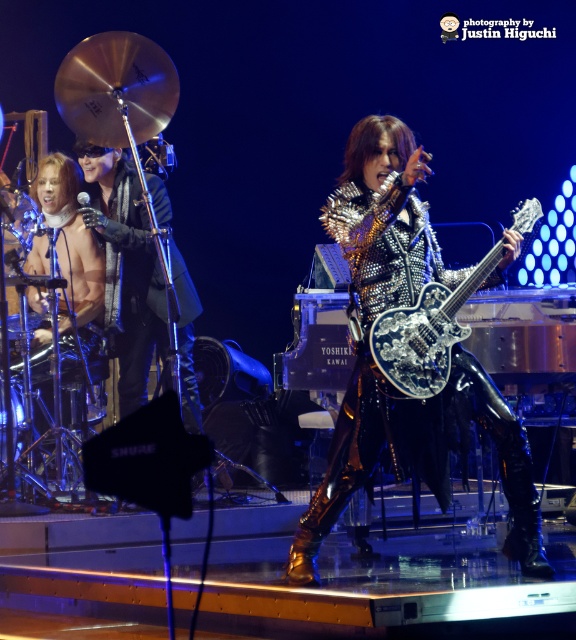
You are a photographer at the concert. You need to place a spotlight at the point with coordinates point (376, 365). Which object should you direct the spotlight towards?

The point (376, 365) is on the shiny metallic guitar at center, so you should direct the spotlight towards the shiny metallic guitar at center.

You are a stagehand who needs to place a microphone stand exactly at the coordinates where the shiny metallic guitar at center is located. What coordinates should you set the microphone stand to?

The shiny metallic guitar at center is located at coordinates point (x=376, y=365), so the microphone stand should be placed there.

You are a stagehand setting up for a concert. You need to place a new amplifier that is 1.2 meters wide. There is space between the shiny metallic guitar at center and the silver metallic guitar at center. Will the amplifier fit in that space?

The shiny metallic guitar at center is larger in size than the silver metallic guitar at center. However, the exact distance between them isn not provided in the description, so we cannot determine if the amplifier will fit.